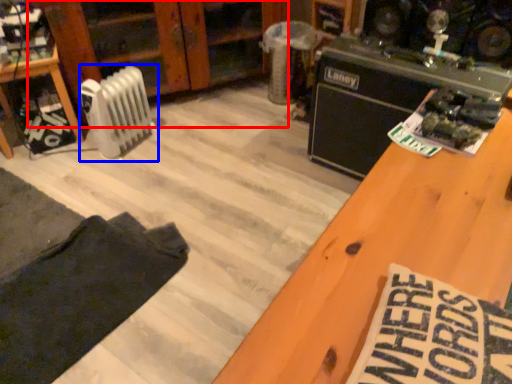
Question: Among these objects, which one is farthest to the camera, dresser (highlighted by a red box) or radiator (highlighted by a blue box)?

Choices:
 (A) dresser
 (B) radiator

Answer: (A)